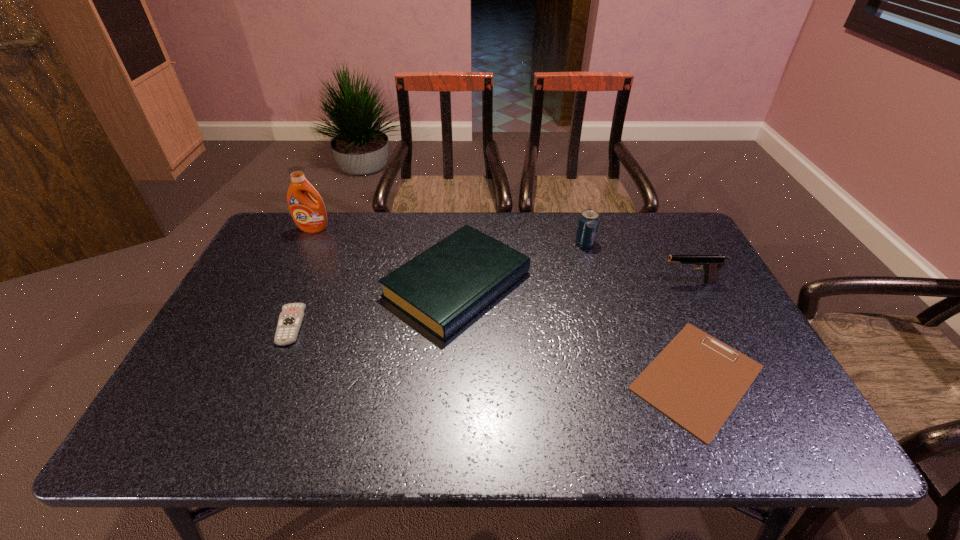
I want to click on vacant space situated at the muzzle of the pistol, so click(x=552, y=281).

At what (x,y) coordinates should I click in order to perform the action: click on vacant area situated at the muzzle of the pistol. Please return your answer as a coordinate pair (x, y). Looking at the image, I should click on 583,281.

Where is `vacant space located 0.210m at the muzzle of the pistol`? This screenshot has width=960, height=540. vacant space located 0.210m at the muzzle of the pistol is located at coordinates 589,281.

Find the location of a particular element. vacant area situated 0.280m on the right of the book is located at coordinates (628, 284).

Where is `vacant space located on the right of the second shortest object`? The width and height of the screenshot is (960, 540). vacant space located on the right of the second shortest object is located at coordinates (402, 326).

The height and width of the screenshot is (540, 960). In order to click on free space located on the back of the clipboard in this screenshot , I will do pos(654,278).

This screenshot has height=540, width=960. What are the coordinates of `detergent present at the far edge` in the screenshot? It's located at (309, 215).

You are a GUI agent. You are given a task and a screenshot of the screen. Output one action in this format:
    pyautogui.click(x=<x>, y=<y>)
    Task: Click on the pop soda positioned at the far edge
    
    Given the screenshot: What is the action you would take?
    pyautogui.click(x=588, y=223)

This screenshot has height=540, width=960. Identify the location of book at the far edge. (442, 288).

Image resolution: width=960 pixels, height=540 pixels. Identify the location of object that is positioned at the near edge. (696, 380).